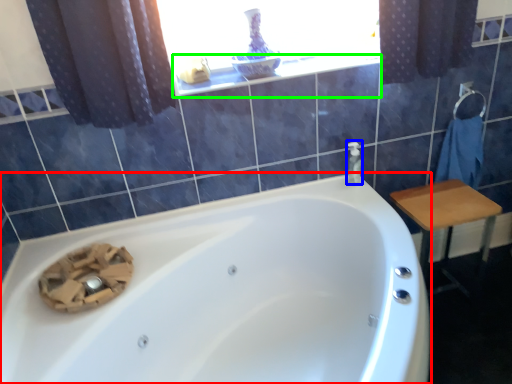
Question: Which object is positioned closest to bathtub (highlighted by a red box)? Select from soap dispenser (highlighted by a blue box) and window sill (highlighted by a green box).

Choices:
 (A) soap dispenser
 (B) window sill

Answer: (A)